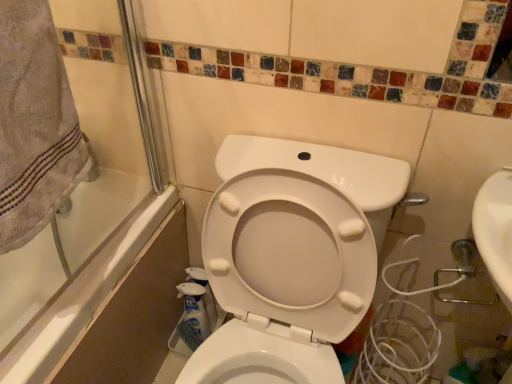
Question: From the image's perspective, is beige cotton towel at upper left on translucent plastic spray bottle at lower center, the 1th cleaning product when ordered from front to back?

Choices:
 (A) yes
 (B) no

Answer: (A)

Question: Is beige cotton towel at upper left positioned with its back to translucent plastic spray bottle at lower center, the 1th cleaning product when ordered from front to back?

Choices:
 (A) no
 (B) yes

Answer: (A)

Question: Is beige cotton towel at upper left positioned far away from translucent plastic spray bottle at lower center, placed as the second cleaning product when sorted from back to front?

Choices:
 (A) no
 (B) yes

Answer: (A)

Question: Is beige cotton towel at upper left facing towards translucent plastic spray bottle at lower center, placed as the second cleaning product when sorted from back to front?

Choices:
 (A) no
 (B) yes

Answer: (A)

Question: From a real-world perspective, is beige cotton towel at upper left over translucent plastic spray bottle at lower center, placed as the second cleaning product when sorted from back to front?

Choices:
 (A) yes
 (B) no

Answer: (A)

Question: Visually, is white glossy bathtub at left positioned to the left or to the right of translucent plastic spray bottle at lower center, placed as the second cleaning product when sorted from back to front?

Choices:
 (A) right
 (B) left

Answer: (B)

Question: Is white glossy bathtub at left in front of or behind translucent plastic spray bottle at lower center, the 1th cleaning product when ordered from front to back, in the image?

Choices:
 (A) behind
 (B) front

Answer: (B)

Question: From the image's perspective, is white glossy bathtub at left above or below translucent plastic spray bottle at lower center, placed as the second cleaning product when sorted from back to front?

Choices:
 (A) above
 (B) below

Answer: (A)

Question: Looking at the image, does white glossy bathtub at left seem bigger or smaller compared to translucent plastic spray bottle at lower center, the 1th cleaning product when ordered from front to back?

Choices:
 (A) small
 (B) big

Answer: (B)

Question: Do you think white glossy bottle at lower center, the second cleaning product from the front, is within beige cotton towel at upper left, or outside of it?

Choices:
 (A) outside
 (B) inside

Answer: (A)

Question: Considering their positions, is white glossy bottle at lower center, marked as the first cleaning product in a back-to-front arrangement, located in front of or behind beige cotton towel at upper left?

Choices:
 (A) behind
 (B) front

Answer: (A)

Question: From a real-world perspective, relative to beige cotton towel at upper left, is white glossy bottle at lower center, marked as the first cleaning product in a back-to-front arrangement, vertically above or below?

Choices:
 (A) above
 (B) below

Answer: (B)

Question: Considering the positions of white glossy bottle at lower center, the second cleaning product from the front, and beige cotton towel at upper left in the image, is white glossy bottle at lower center, the second cleaning product from the front, taller or shorter than beige cotton towel at upper left?

Choices:
 (A) short
 (B) tall

Answer: (A)

Question: From a real-world perspective, is white glossy bathtub at left physically located above or below beige cotton towel at upper left?

Choices:
 (A) above
 (B) below

Answer: (B)

Question: Considering the relative positions of white glossy bathtub at left and beige cotton towel at upper left in the image provided, is white glossy bathtub at left to the left or to the right of beige cotton towel at upper left?

Choices:
 (A) right
 (B) left

Answer: (B)